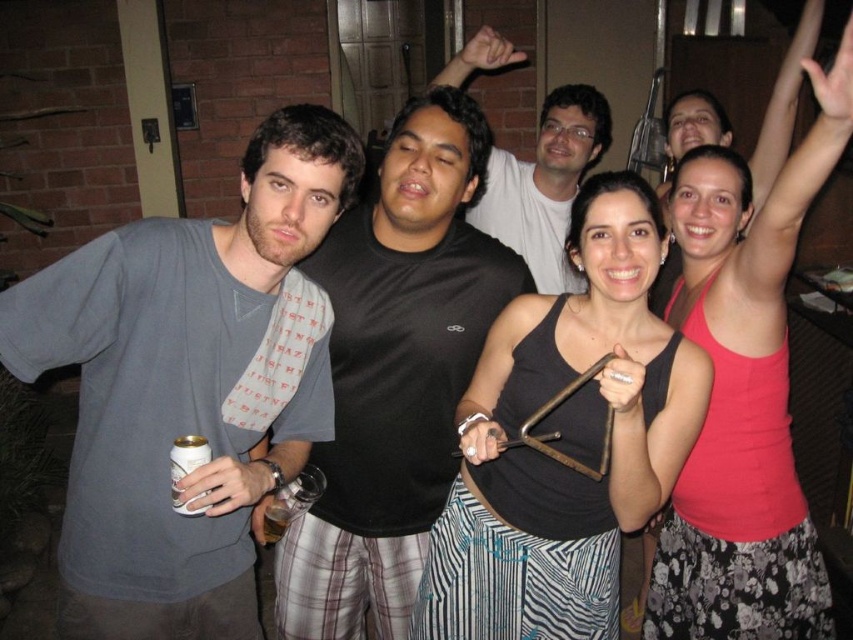
Is translucent glass beer at lower center taller than silver metallic can at lower left?

Yes, translucent glass beer at lower center is taller than silver metallic can at lower left.

Is translucent glass beer at lower center to the right of silver metallic can at lower left from the viewer's perspective?

Correct, you'll find translucent glass beer at lower center to the right of silver metallic can at lower left.

Does point (279, 532) lie in front of point (204, 444)?

That is False.

The image size is (853, 640). I want to click on translucent glass beer at lower center, so click(289, 500).

Who is higher up, gray cotton t-shirt at left or silver metallic can at lower left?

Positioned higher is gray cotton t-shirt at left.

Which is behind, point (242, 179) or point (196, 461)?

Point (242, 179)

Where is `gray cotton t-shirt at left`? This screenshot has width=853, height=640. gray cotton t-shirt at left is located at coordinates (189, 385).

In the scene shown: Does pink fabric tank top at upper right appear under black matte shirt at center?

Correct, pink fabric tank top at upper right is located below black matte shirt at center.

You are a GUI agent. You are given a task and a screenshot of the screen. Output one action in this format:
    pyautogui.click(x=<x>, y=<y>)
    Task: Click on the pink fabric tank top at upper right
    
    Given the screenshot: What is the action you would take?
    pyautogui.click(x=744, y=396)